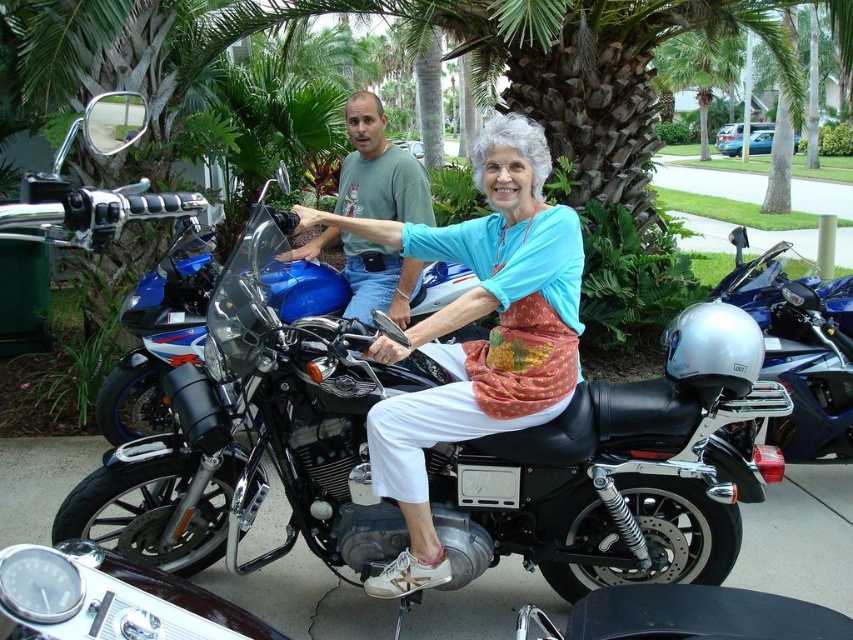
You are a delivery person who needs to place a rectangular package that is 20 cm wide on the matte blue helmet at upper center and the glossy blue motorcycle at center. Based on their widths, which object can the package fit on?

The matte blue helmet at upper center has a larger width than the glossy blue motorcycle at center, so the package can fit on the matte blue helmet at upper center.

Where is the matte blue helmet at upper center located in the image?

The matte blue helmet at upper center is located at point coordinates of (x=479, y=339).